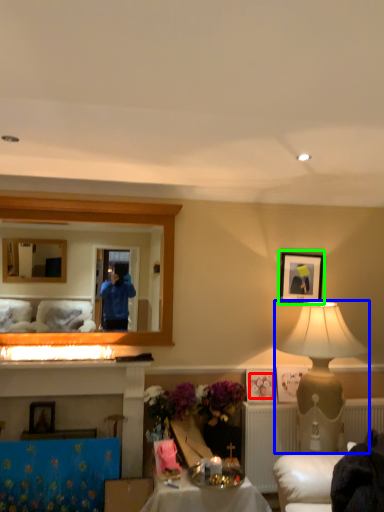
Question: Considering the real-world distances, which object is farthest from flower (highlighted by a red box)? table lamp (highlighted by a blue box) or picture frame (highlighted by a green box)?

Choices:
 (A) table lamp
 (B) picture frame

Answer: (B)